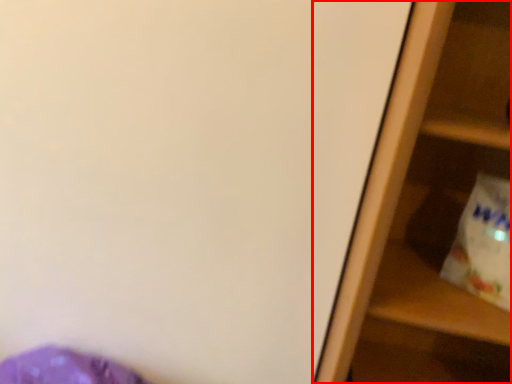
Question: Observing the image, what is the correct spatial positioning of shelf (annotated by the red box) in reference to grocery bag?

Choices:
 (A) right
 (B) left

Answer: (B)